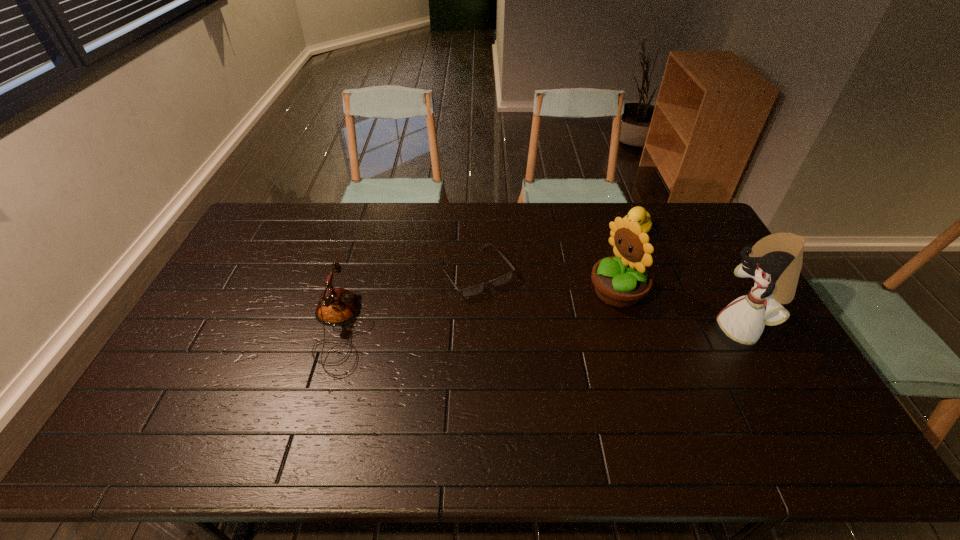
This screenshot has width=960, height=540. What are the coordinates of `object at the far edge` in the screenshot? It's located at (639, 214).

Identify the location of object located at the right edge. Image resolution: width=960 pixels, height=540 pixels. (775, 262).

In the image, there is a desktop. Identify the location of vacant space at the far edge. The width and height of the screenshot is (960, 540). (384, 205).

I want to click on free space at the near edge of the desktop, so click(342, 398).

In the image, there is a desktop. In order to click on vacant space at the left edge in this screenshot , I will do `click(225, 334)`.

Locate an element on the screen. free spot at the far left corner of the desktop is located at coordinates (273, 217).

Find the location of `free space between the leftmost object and the farthest object`. free space between the leftmost object and the farthest object is located at coordinates pyautogui.click(x=488, y=281).

This screenshot has width=960, height=540. Find the location of `vacant space that is in between the telephone and the sunflower`. vacant space that is in between the telephone and the sunflower is located at coordinates (479, 311).

Locate an element on the screen. Image resolution: width=960 pixels, height=540 pixels. free point between the duckling and the shortest object is located at coordinates (555, 252).

What are the coordinates of `free space between the telephone and the farthest object` in the screenshot? It's located at (488, 281).